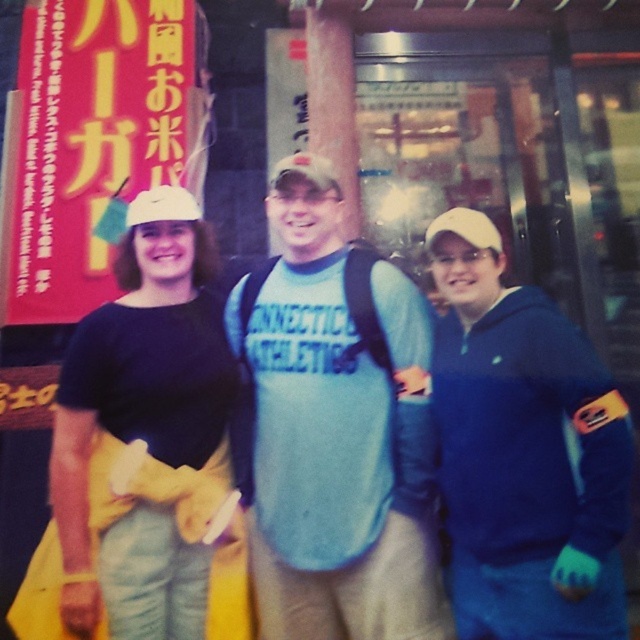
Does blue fleece jacket at center have a greater width compared to white matte baseball cap at center?

Indeed, blue fleece jacket at center has a greater width compared to white matte baseball cap at center.

Describe the element at coordinates (524, 451) in the screenshot. The image size is (640, 640). I see `blue fleece jacket at center` at that location.

Is point (604, 540) closer to camera compared to point (193, 204)?

Yes, point (604, 540) is closer to viewer.

At what (x,y) coordinates should I click in order to perform the action: click on blue fleece jacket at center. Please return your answer as a coordinate pair (x, y). Looking at the image, I should click on (524, 451).

Based on the photo, between matte black shirt at center and white matte baseball cap at center, which one has less height?

white matte baseball cap at center is shorter.

Who is taller, matte black shirt at center or white matte baseball cap at center?

Standing taller between the two is matte black shirt at center.

Does point (65, 449) come farther from viewer compared to point (188, 214)?

That is False.

The width and height of the screenshot is (640, 640). Find the location of `matte black shirt at center`. matte black shirt at center is located at coordinates (144, 429).

Who is more forward, (291, 452) or (188, 216)?

Point (291, 452)

Is point (396, 500) positioned in front of point (164, 212)?

Yes, point (396, 500) is closer to viewer.

Does point (378, 266) come closer to viewer compared to point (168, 205)?

Yes, point (378, 266) is closer to viewer.

What are the coordinates of `blue cotton t-shirt at center` in the screenshot? It's located at (333, 429).